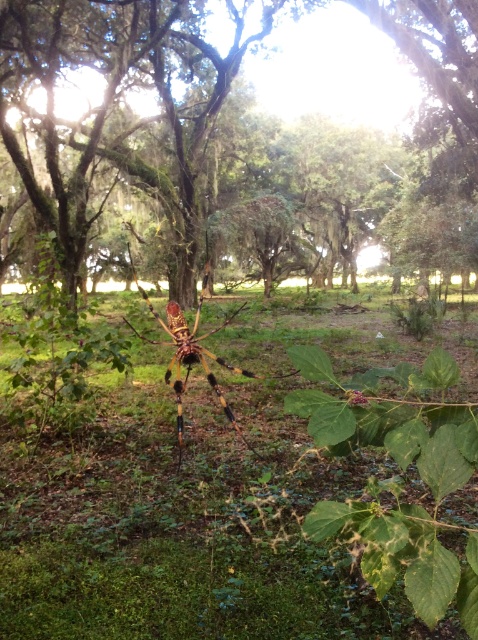
Between yellow-green textured spider at center and multicolored metallic garden spider at center, which one appears on the right side from the viewer's perspective?

Positioned to the right is yellow-green textured spider at center.

Is point (251, 38) positioned behind point (187, 365)?

Yes, point (251, 38) is farther from viewer.

I want to click on yellow-green textured spider at center, so click(435, 49).